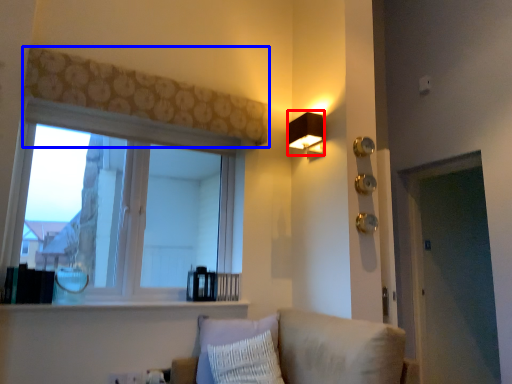
Question: Which object is further to the camera taking this photo, lamp (highlighted by a red box) or curtain (highlighted by a blue box)?

Choices:
 (A) lamp
 (B) curtain

Answer: (A)